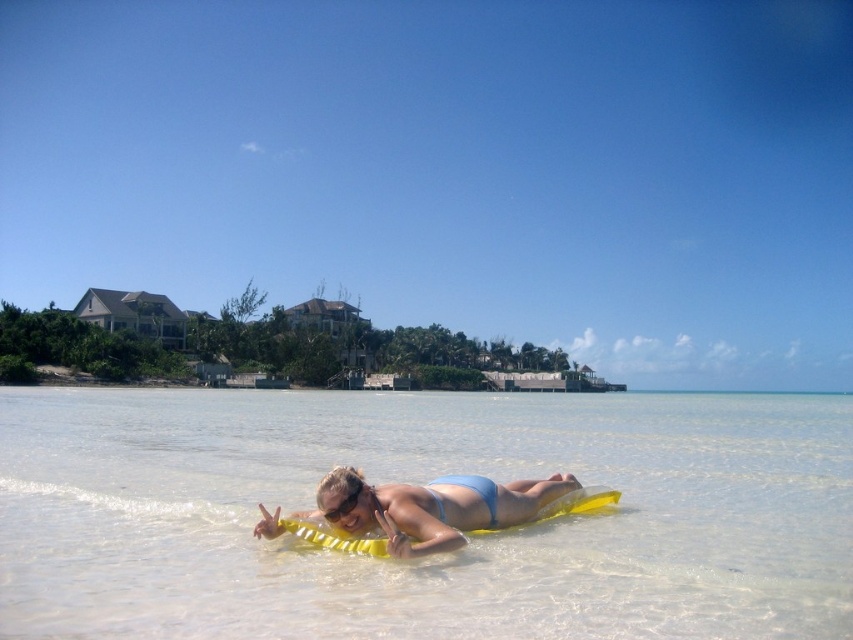
Is clear water at center smaller than transparent plastic goggles at center?

No.

Does point (148, 596) come in front of point (358, 492)?

Yes, it is in front of point (358, 492).

In order to click on clear water at center in this screenshot , I will do `click(421, 483)`.

Can you confirm if clear water at center is shorter than blue matte bikini top at center?

In fact, clear water at center may be taller than blue matte bikini top at center.

Can you confirm if clear water at center is positioned to the left of blue matte bikini top at center?

Yes, clear water at center is to the left of blue matte bikini top at center.

What do you see at coordinates (421, 483) in the screenshot? Image resolution: width=853 pixels, height=640 pixels. I see `clear water at center` at bounding box center [421, 483].

Where is `clear water at center`? clear water at center is located at coordinates (421, 483).

Does blue matte bikini top at center appear on the right side of blue matte bikini at center?

In fact, blue matte bikini top at center is to the left of blue matte bikini at center.

Who is taller, blue matte bikini top at center or blue matte bikini at center?

Standing taller between the two is blue matte bikini top at center.

This screenshot has width=853, height=640. In order to click on blue matte bikini top at center in this screenshot , I will do `click(430, 508)`.